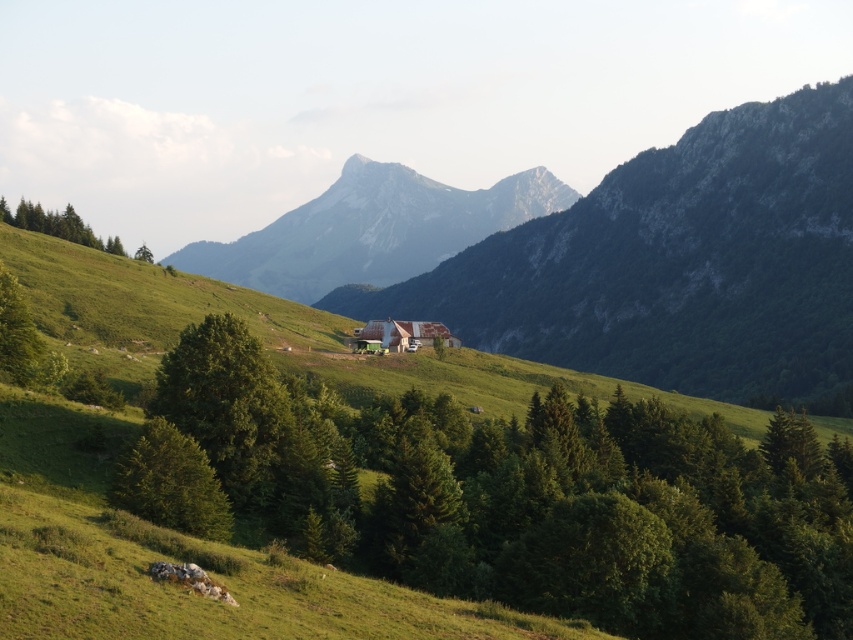
Question: Which object appears farthest from the camera in this image?

Choices:
 (A) green matte tree at upper left
 (B) gray rocky mountain at center
 (C) green matte tree at center
 (D) green matte tree at lower left

Answer: (B)

Question: Among these points, which one is nearest to the camera?

Choices:
 (A) (344, 246)
 (B) (190, 493)
 (C) (508, 490)
 (D) (90, 230)

Answer: (B)

Question: Which is nearer to the green matte tree at lower left?

Choices:
 (A) gray rocky mountain at center
 (B) green matte tree at upper left
 (C) green matte tree at center

Answer: (C)

Question: Can you confirm if green matte tree at lower left is smaller than green matte tree at upper left?

Choices:
 (A) no
 (B) yes

Answer: (B)

Question: Is green matte tree at lower left closer to the viewer compared to green matte tree at upper left?

Choices:
 (A) yes
 (B) no

Answer: (A)

Question: Considering the relative positions of gray rocky mountain at center and green matte tree at upper left in the image provided, where is gray rocky mountain at center located with respect to green matte tree at upper left?

Choices:
 (A) left
 (B) right

Answer: (B)